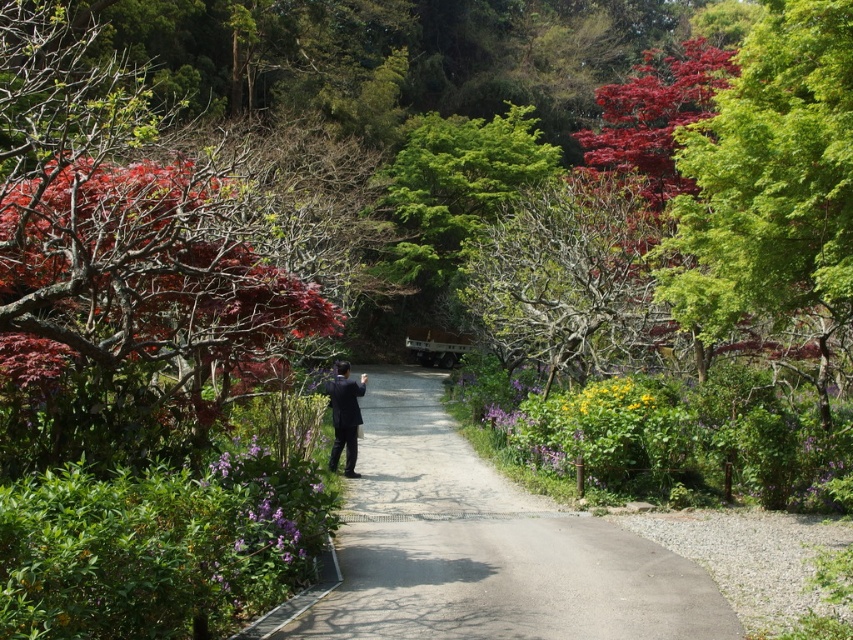
Between purple matte flower at lower left and black suit at center, which one has more height?

With more height is black suit at center.

Can you confirm if purple matte flower at lower left is positioned below black suit at center?

Correct, purple matte flower at lower left is located below black suit at center.

Measure the distance between purple matte flower at lower left and camera.

They are 6.22 meters apart.

Where is `purple matte flower at lower left`? The width and height of the screenshot is (853, 640). purple matte flower at lower left is located at coordinates (265, 518).

Is gray concrete path at center smaller than black suit at center?

Incorrect, gray concrete path at center is not smaller in size than black suit at center.

Is point (508, 589) closer to viewer compared to point (363, 378)?

Yes.

Does point (456, 625) come closer to viewer compared to point (345, 420)?

That is True.

This screenshot has height=640, width=853. What are the coordinates of `gray concrete path at center` in the screenshot? It's located at (486, 547).

Who is taller, purple matte flower at lower left or yellow matte flower at center?

purple matte flower at lower left

Who is positioned more to the right, purple matte flower at lower left or yellow matte flower at center?

yellow matte flower at center is more to the right.

Where is `purple matte flower at lower left`? purple matte flower at lower left is located at coordinates (265, 518).